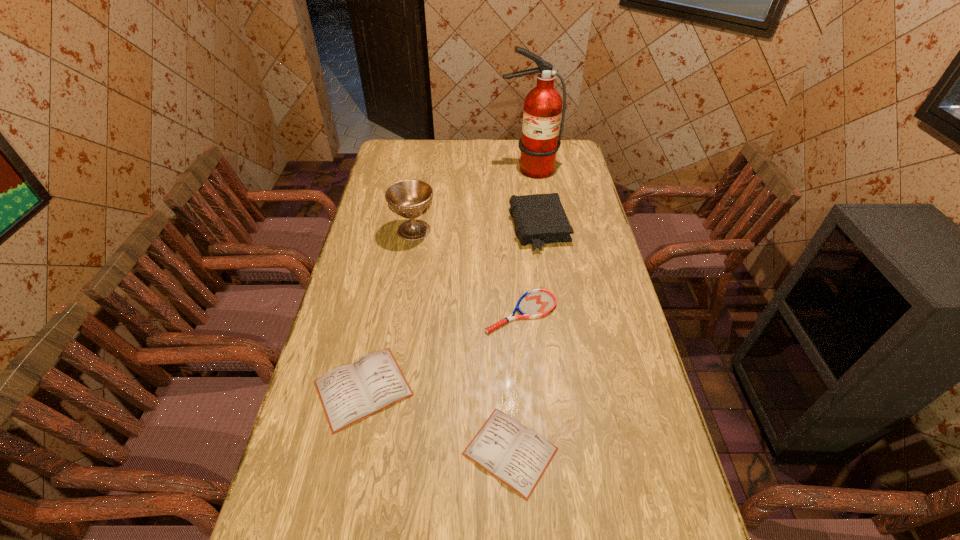
Image resolution: width=960 pixels, height=540 pixels. Identify the location of the fourth tallest object. (349, 393).

This screenshot has height=540, width=960. Find the location of `the left diary`. the left diary is located at coordinates (349, 393).

Identify the location of the shorter diary. The image size is (960, 540). (517, 456).

Locate an element on the screen. The height and width of the screenshot is (540, 960). the tallest object is located at coordinates (543, 104).

Find the location of a particular element. The height and width of the screenshot is (540, 960). the farthest object is located at coordinates (543, 104).

You are a GUI agent. You are given a task and a screenshot of the screen. Output one action in this format:
    pyautogui.click(x=<x>, y=<y>)
    Task: Click on the Bible
    The width and height of the screenshot is (960, 540).
    Given the screenshot: What is the action you would take?
    pyautogui.click(x=540, y=219)

Find the location of a particular element. chalice is located at coordinates (410, 199).

Where is `tennis racket`? This screenshot has height=540, width=960. tennis racket is located at coordinates (535, 303).

You are a GUI agent. You are given a task and a screenshot of the screen. Output one action in this format:
    pyautogui.click(x=<x>, y=<y>)
    Task: Click on the free space located on the right of the third shortest object
    This screenshot has width=960, height=540.
    Given the screenshot: What is the action you would take?
    pyautogui.click(x=502, y=388)

Find the location of `vacant space located on the right of the shorter diary`. vacant space located on the right of the shorter diary is located at coordinates (627, 451).